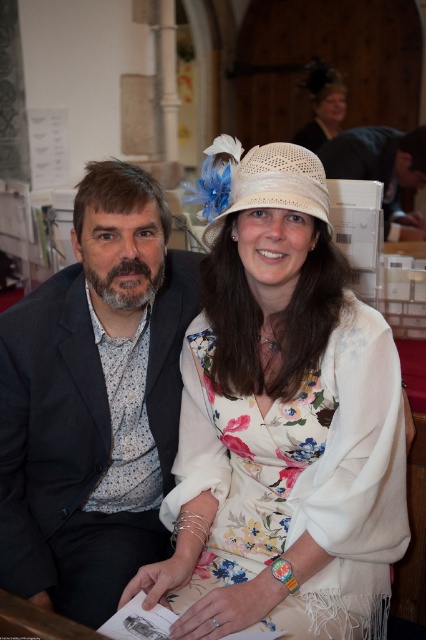
Question: From the image, what is the correct spatial relationship of dark gray suit at center in relation to white straw hat at center?

Choices:
 (A) left
 (B) right

Answer: (A)

Question: Does dark gray suit at center have a larger size compared to dark brown leather jacket at upper right?

Choices:
 (A) no
 (B) yes

Answer: (A)

Question: Which point appears farthest from the camera in this image?

Choices:
 (A) (422, 234)
 (B) (210, 396)
 (C) (293, 184)
 (D) (97, 500)

Answer: (A)

Question: Does floral silk dress at center appear on the left side of dark brown leather jacket at upper right?

Choices:
 (A) no
 (B) yes

Answer: (B)

Question: Estimate the real-world distances between objects in this image. Which object is closer to the dark gray suit at center?

Choices:
 (A) dark brown leather jacket at upper right
 (B) white straw hat at center

Answer: (B)

Question: Based on their relative distances, which object is nearer to the floral silk dress at center?

Choices:
 (A) dark brown leather jacket at upper right
 (B) white straw hat at center

Answer: (B)